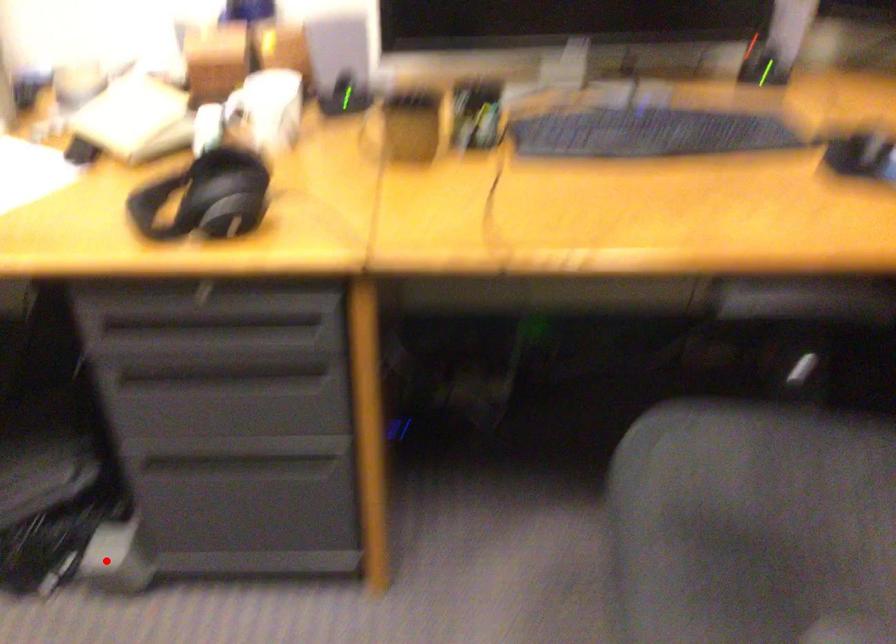
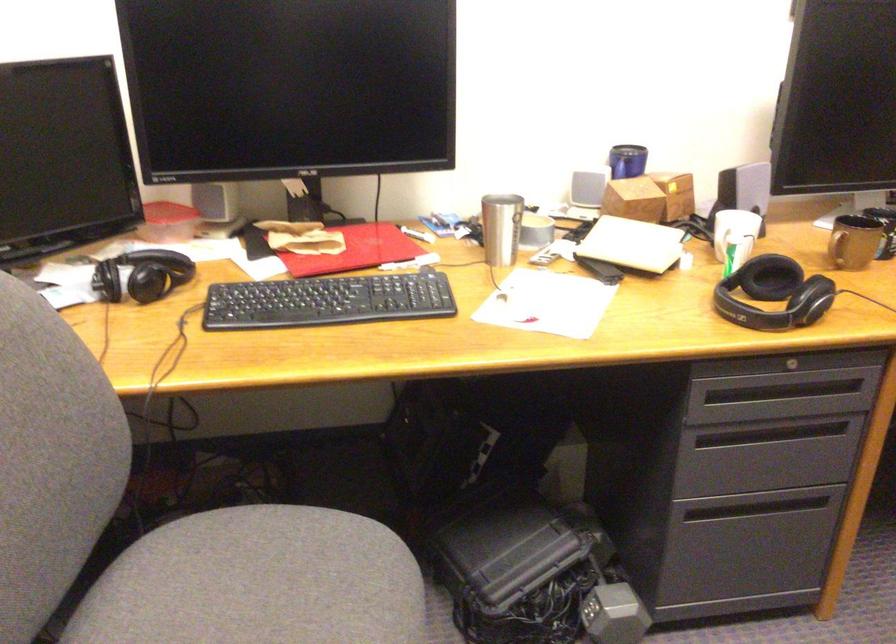
Find the pixel in the second image that matches the highlighted location in the first image.

(614, 614)